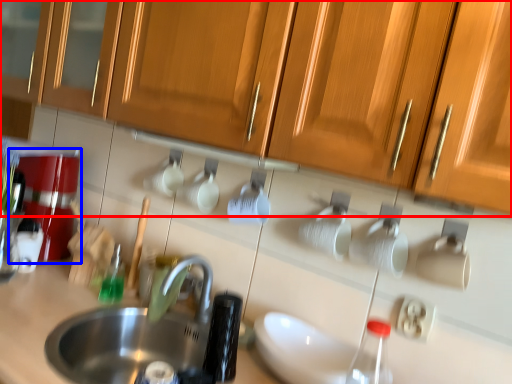
Question: Which object appears closest to the camera in this image, cabinetry (highlighted by a red box) or coffee machine (highlighted by a blue box)?

Choices:
 (A) cabinetry
 (B) coffee machine

Answer: (A)